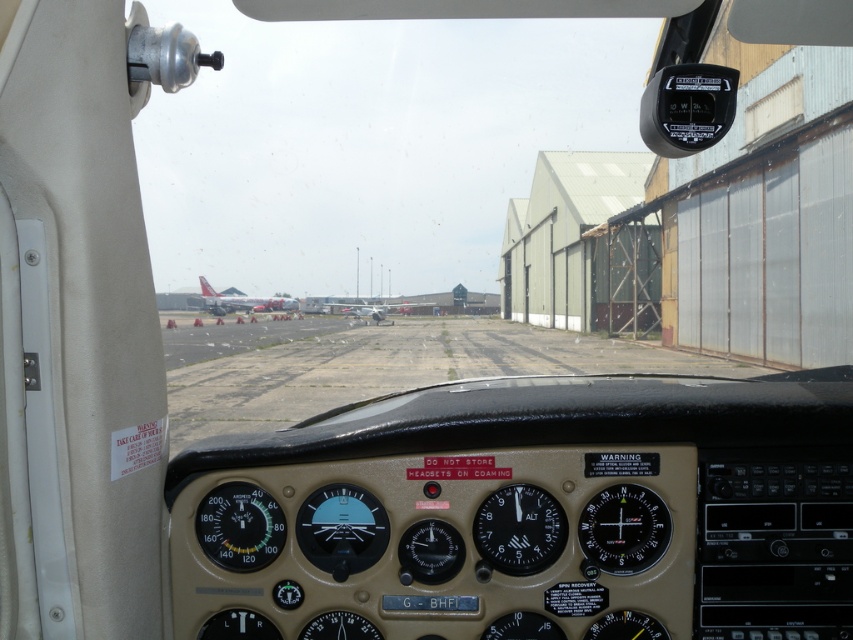
Can you confirm if black plastic altimeter at center is bigger than silver metallic airplane at center?

No.

Who is positioned more to the left, black plastic altimeter at center or silver metallic airplane at center?

silver metallic airplane at center

The height and width of the screenshot is (640, 853). Describe the element at coordinates (519, 529) in the screenshot. I see `black plastic altimeter at center` at that location.

I want to click on black plastic altimeter at center, so click(519, 529).

Is black plastic altimeter at center bigger than metallic gray airplane at center?

Actually, black plastic altimeter at center might be smaller than metallic gray airplane at center.

Between point (527, 560) and point (426, 304), which one is positioned in front?

Point (527, 560) is in front.

You are a GUI agent. You are given a task and a screenshot of the screen. Output one action in this format:
    pyautogui.click(x=<x>, y=<y>)
    Task: Click on the black plastic altimeter at center
    This screenshot has width=853, height=640.
    Given the screenshot: What is the action you would take?
    pyautogui.click(x=519, y=529)

From the picture: Does black plastic altimeter at center appear over transparent glass altimeter at center?

Indeed, black plastic altimeter at center is positioned over transparent glass altimeter at center.

Does black plastic altimeter at center come behind transparent glass altimeter at center?

Yes.

Find the location of a particular element. black plastic altimeter at center is located at coordinates (519, 529).

Locate an element on the screen. black plastic altimeter at center is located at coordinates (519, 529).